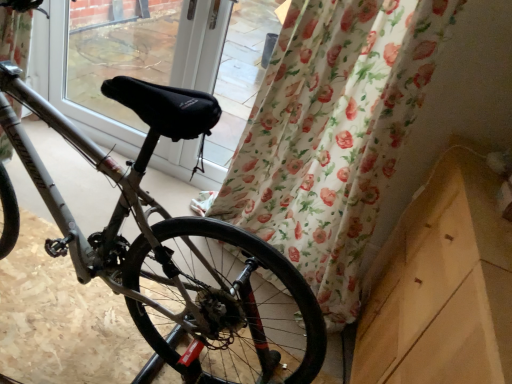
In order to click on silver metallic bicycle wheel at lower left in this screenshot , I will do `click(225, 304)`.

Where is `black fabric at center`? black fabric at center is located at coordinates (159, 65).

The height and width of the screenshot is (384, 512). What do you see at coordinates (331, 135) in the screenshot?
I see `floral fabric curtain at lower right` at bounding box center [331, 135].

Locate an element on the screen. The height and width of the screenshot is (384, 512). silver metallic bicycle at center is located at coordinates (177, 250).

How different are the orientations of silver metallic bicycle wheel at lower left and silver metallic bicycle at center in degrees?

They differ by 85.9 degrees in their facing directions.

Is silver metallic bicycle wheel at lower left far away from silver metallic bicycle at center?

No, silver metallic bicycle wheel at lower left is not far away from silver metallic bicycle at center.

Does silver metallic bicycle wheel at lower left turn towards silver metallic bicycle at center?

No, silver metallic bicycle wheel at lower left does not turn towards silver metallic bicycle at center.

Is silver metallic bicycle wheel at lower left at the left side of silver metallic bicycle at center?

Correct, you'll find silver metallic bicycle wheel at lower left to the left of silver metallic bicycle at center.

From the image's perspective, which is above, black fabric at center or silver metallic bicycle wheel at lower left?

black fabric at center appears higher in the image.

How different are the orientations of black fabric at center and silver metallic bicycle wheel at lower left in degrees?

There is a 3.69-degree angle between the facing directions of black fabric at center and silver metallic bicycle wheel at lower left.

Considering the positions of objects black fabric at center and silver metallic bicycle wheel at lower left in the image provided, who is more to the right, black fabric at center or silver metallic bicycle wheel at lower left?

black fabric at center.

Is black fabric at center behind silver metallic bicycle wheel at lower left?

Yes, black fabric at center is behind silver metallic bicycle wheel at lower left.

Is point (374, 78) positioned after point (74, 103)?

No, (374, 78) is in front of (74, 103).

You are a GUI agent. You are given a task and a screenshot of the screen. Output one action in this format:
    pyautogui.click(x=<x>, y=<y>)
    Task: Click on the curtain lying on the right of black fabric at center
    
    Given the screenshot: What is the action you would take?
    pyautogui.click(x=331, y=135)

Can black fabric at center be found inside floral fabric curtain at lower right?

No, black fabric at center is located outside of floral fabric curtain at lower right.

Is black fabric at center spatially inside silver metallic bicycle at center, or outside of it?

black fabric at center is not inside silver metallic bicycle at center, it's outside.

From the image's perspective, is black fabric at center on silver metallic bicycle at center?

Yes, from the image's perspective, black fabric at center is over silver metallic bicycle at center.

Considering the positions of objects black fabric at center and silver metallic bicycle at center in the image provided, who is behind, black fabric at center or silver metallic bicycle at center?

black fabric at center is more distant.

Is black fabric at center taller than silver metallic bicycle at center?

Correct, black fabric at center is much taller as silver metallic bicycle at center.

Considering the relative positions of silver metallic bicycle at center and silver metallic bicycle wheel at lower left in the image provided, is silver metallic bicycle at center to the left of silver metallic bicycle wheel at lower left from the viewer's perspective?

No.

Between silver metallic bicycle at center and silver metallic bicycle wheel at lower left, which one has more height?

Standing taller between the two is silver metallic bicycle at center.

You are a GUI agent. You are given a task and a screenshot of the screen. Output one action in this format:
    pyautogui.click(x=<x>, y=<y>)
    Task: Click on the bicycle in front of the silver metallic bicycle wheel at lower left
    
    Given the screenshot: What is the action you would take?
    pyautogui.click(x=177, y=250)

Measure the distance from silver metallic bicycle at center to silver metallic bicycle wheel at lower left.

A distance of 2.27 inches exists between silver metallic bicycle at center and silver metallic bicycle wheel at lower left.

From their relative heights in the image, would you say floral fabric curtain at lower right is taller or shorter than silver metallic bicycle at center?

Clearly, floral fabric curtain at lower right is taller compared to silver metallic bicycle at center.

Considering the relative positions of floral fabric curtain at lower right and silver metallic bicycle at center in the image provided, is floral fabric curtain at lower right to the left or to the right of silver metallic bicycle at center?

From the image, it's evident that floral fabric curtain at lower right is to the right of silver metallic bicycle at center.

Which point is more forward, (277, 119) or (111, 239)?

The point (111, 239) is closer to the camera.

From the image's perspective, between floral fabric curtain at lower right and silver metallic bicycle at center, which one is located above?

floral fabric curtain at lower right appears higher in the image.

How many degrees apart are the facing directions of silver metallic bicycle wheel at lower left and floral fabric curtain at lower right?

The facing directions of silver metallic bicycle wheel at lower left and floral fabric curtain at lower right are 2.83 degrees apart.

From a real-world perspective, between silver metallic bicycle wheel at lower left and floral fabric curtain at lower right, who is vertically lower?

silver metallic bicycle wheel at lower left is physically lower.

Would you consider silver metallic bicycle wheel at lower left to be distant from floral fabric curtain at lower right?

No, silver metallic bicycle wheel at lower left is not far from floral fabric curtain at lower right.

From the image's perspective, is silver metallic bicycle wheel at lower left above or below floral fabric curtain at lower right?

From the image's perspective, silver metallic bicycle wheel at lower left appears below floral fabric curtain at lower right.

Where is `wheel lying behind the silver metallic bicycle at center`? The image size is (512, 384). wheel lying behind the silver metallic bicycle at center is located at coordinates (225, 304).

Where is `wheel in front of the black fabric at center`? wheel in front of the black fabric at center is located at coordinates (225, 304).

In the scene shown: Looking at the image, which one is located closer to silver metallic bicycle wheel at lower left, floral fabric curtain at lower right or black fabric at center?

floral fabric curtain at lower right.

From the image, which object appears to be nearer to floral fabric curtain at lower right, silver metallic bicycle at center or silver metallic bicycle wheel at lower left?

silver metallic bicycle wheel at lower left.

Considering their positions, is silver metallic bicycle at center positioned further to silver metallic bicycle wheel at lower left than floral fabric curtain at lower right?

floral fabric curtain at lower right lies further to silver metallic bicycle wheel at lower left than the other object.

In the scene shown: From the image, which object appears to be farther from silver metallic bicycle wheel at lower left, black fabric at center or silver metallic bicycle at center?

black fabric at center is positioned further to the anchor silver metallic bicycle wheel at lower left.

When comparing their distances from black fabric at center, does silver metallic bicycle at center or silver metallic bicycle wheel at lower left seem further?

silver metallic bicycle wheel at lower left is positioned further to the anchor black fabric at center.

Estimate the real-world distances between objects in this image. Which object is further from floral fabric curtain at lower right, black fabric at center or silver metallic bicycle at center?

black fabric at center is further to floral fabric curtain at lower right.

Considering their positions, is silver metallic bicycle wheel at lower left positioned closer to floral fabric curtain at lower right than black fabric at center?

silver metallic bicycle wheel at lower left lies closer to floral fabric curtain at lower right than the other object.

Estimate the real-world distances between objects in this image. Which object is further from silver metallic bicycle wheel at lower left, black fabric at center or floral fabric curtain at lower right?

black fabric at center.

Identify the location of curtain positioned between silver metallic bicycle at center and black fabric at center from near to far. The width and height of the screenshot is (512, 384). (331, 135).

This screenshot has width=512, height=384. I want to click on wheel positioned between silver metallic bicycle at center and black fabric at center from near to far, so click(x=225, y=304).

Locate an element on the screen. This screenshot has height=384, width=512. bicycle between silver metallic bicycle wheel at lower left and floral fabric curtain at lower right from left to right is located at coordinates (177, 250).

This screenshot has height=384, width=512. I want to click on curtain that lies between black fabric at center and silver metallic bicycle wheel at lower left from top to bottom, so click(x=331, y=135).